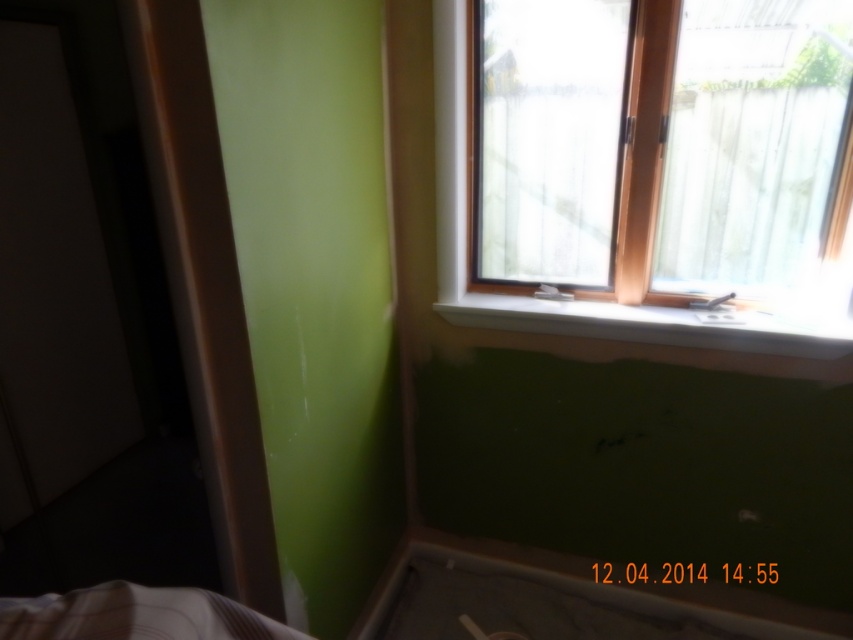
Between point (453, 145) and point (753, 346), which one is positioned in front?

Point (753, 346) is more forward.

In order to click on wooden frame at upper right in this screenshot , I will do pyautogui.click(x=575, y=300).

Locate an element on the screen. wooden frame at upper right is located at coordinates (575, 300).